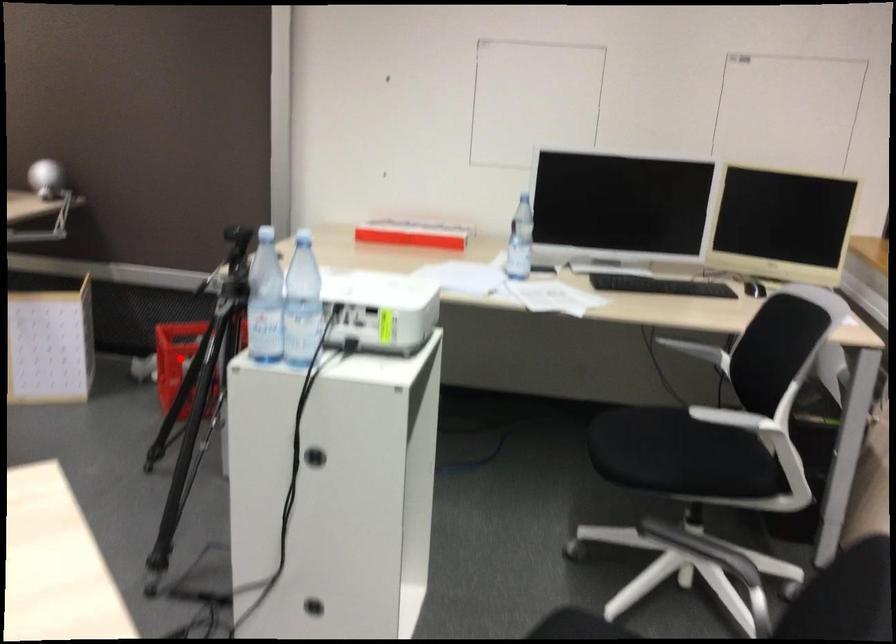
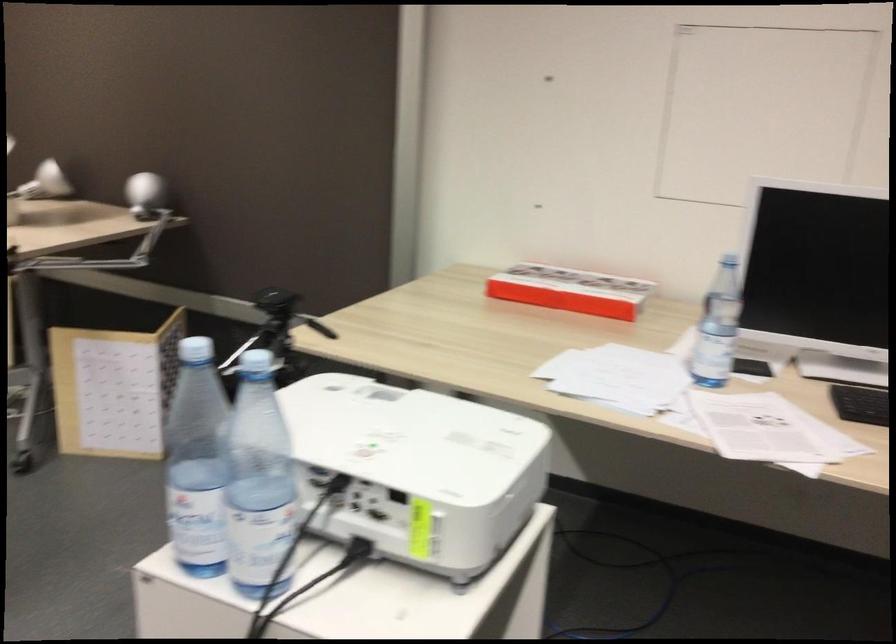
Question: I am providing you with two images of the same scene from different viewpoints. A red point is marked on the first image. At the location where the point appears in image 1, is it still visible in image 2?

Choices:
 (A) Yes
 (B) No

Answer: (B)